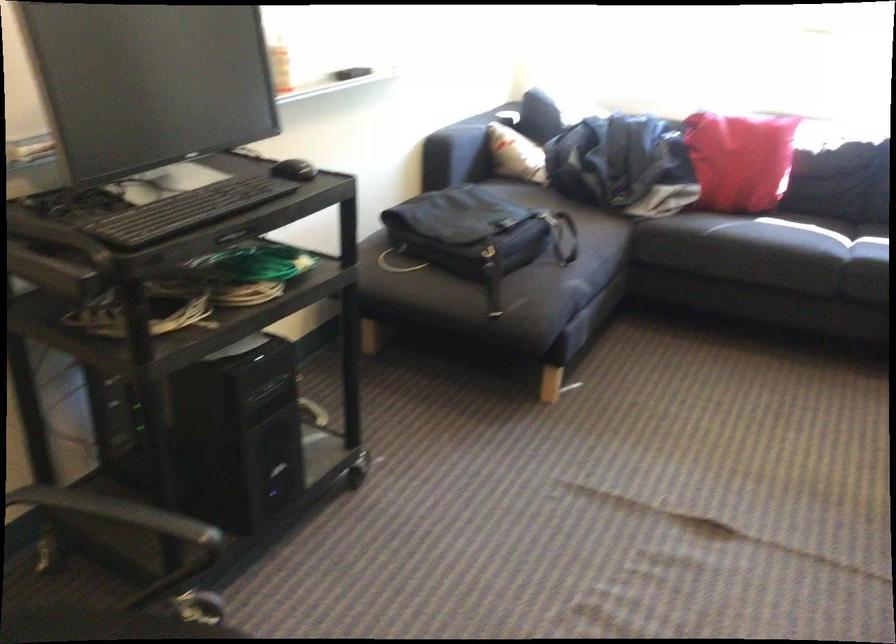
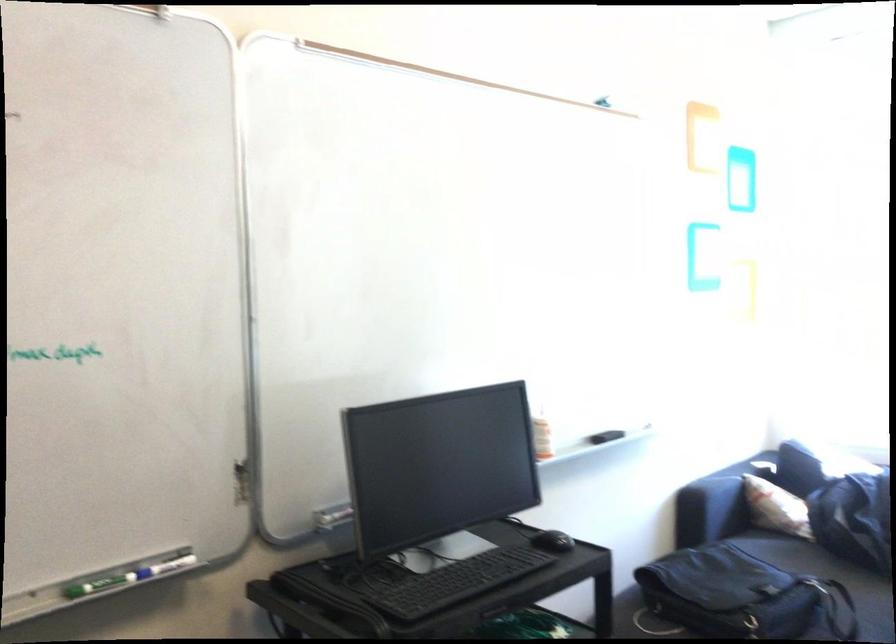
The point at (479, 230) is marked in the first image. Where is the corresponding point in the second image?

(744, 596)